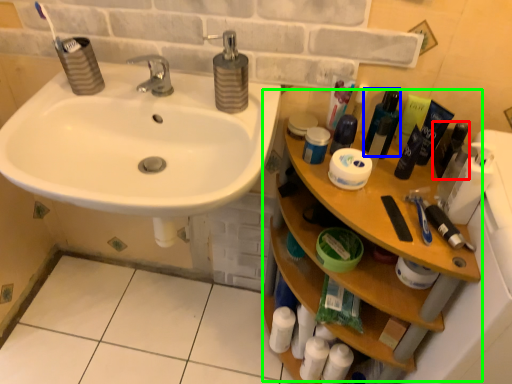
Question: Which object is the farthest from mouthwash (highlighted by a red box)? Choose among these: mouthwash (highlighted by a blue box) or counter (highlighted by a green box).

Choices:
 (A) mouthwash
 (B) counter

Answer: (B)